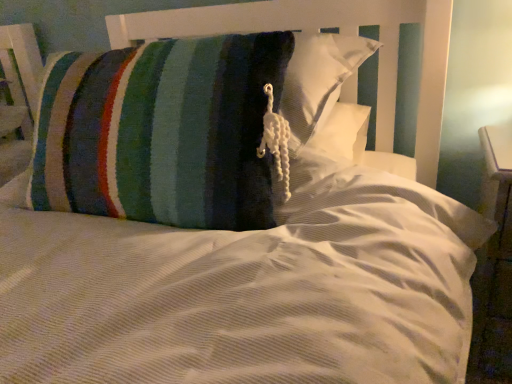
Question: Is knitted striped pillow at center thinner than white glossy dresser at right?

Choices:
 (A) no
 (B) yes

Answer: (A)

Question: Could you tell me if knitted striped pillow at center is turned towards white glossy dresser at right?

Choices:
 (A) yes
 (B) no

Answer: (B)

Question: From the image's perspective, would you say knitted striped pillow at center is shown under white glossy dresser at right?

Choices:
 (A) no
 (B) yes

Answer: (A)

Question: Is knitted striped pillow at center shorter than white glossy dresser at right?

Choices:
 (A) no
 (B) yes

Answer: (B)

Question: Does knitted striped pillow at center appear on the right side of white glossy dresser at right?

Choices:
 (A) no
 (B) yes

Answer: (A)

Question: From the image's perspective, does knitted striped pillow at center appear higher than white glossy dresser at right?

Choices:
 (A) no
 (B) yes

Answer: (B)

Question: Does white glossy dresser at right have a greater width compared to knitted striped pillow at center?

Choices:
 (A) no
 (B) yes

Answer: (A)

Question: Does white glossy dresser at right contain knitted striped pillow at center?

Choices:
 (A) yes
 (B) no

Answer: (B)

Question: Would you consider white glossy dresser at right to be distant from knitted striped pillow at center?

Choices:
 (A) yes
 (B) no

Answer: (B)

Question: Considering the relative positions of white glossy dresser at right and knitted striped pillow at center in the image provided, is white glossy dresser at right behind knitted striped pillow at center?

Choices:
 (A) no
 (B) yes

Answer: (B)

Question: Considering the relative sizes of white glossy dresser at right and knitted striped pillow at center in the image provided, is white glossy dresser at right smaller than knitted striped pillow at center?

Choices:
 (A) no
 (B) yes

Answer: (B)

Question: Is white glossy dresser at right outside knitted striped pillow at center?

Choices:
 (A) yes
 (B) no

Answer: (A)

Question: From the image's perspective, is knitted striped pillow at center positioned above or below white glossy dresser at right?

Choices:
 (A) below
 (B) above

Answer: (B)